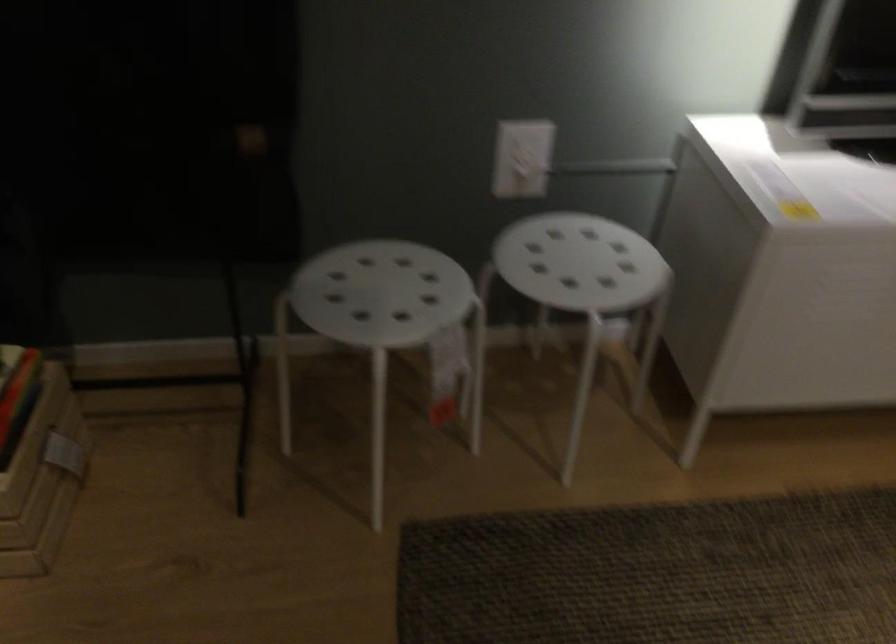
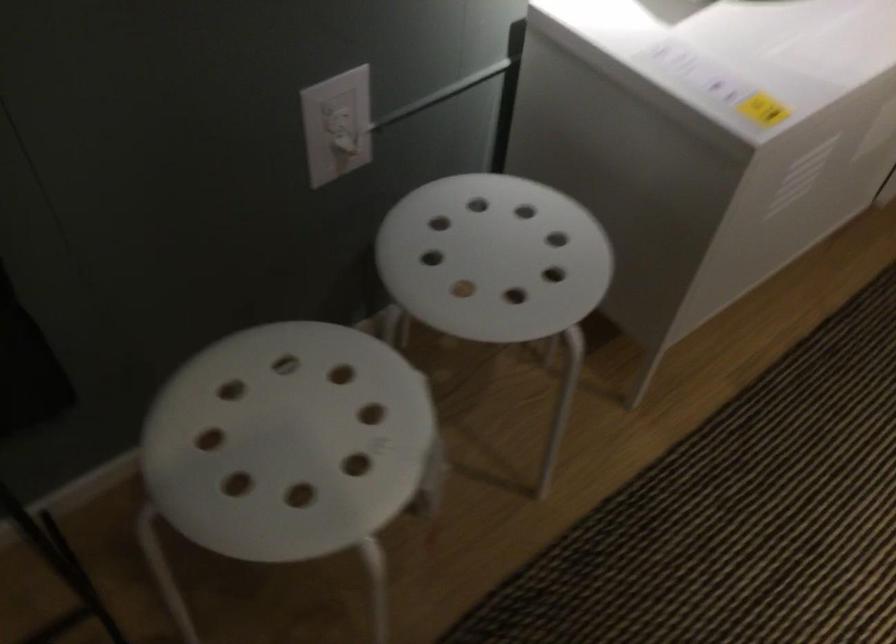
Find the pixel in the second image that matches the point at 373,292 in the first image.

(288, 442)